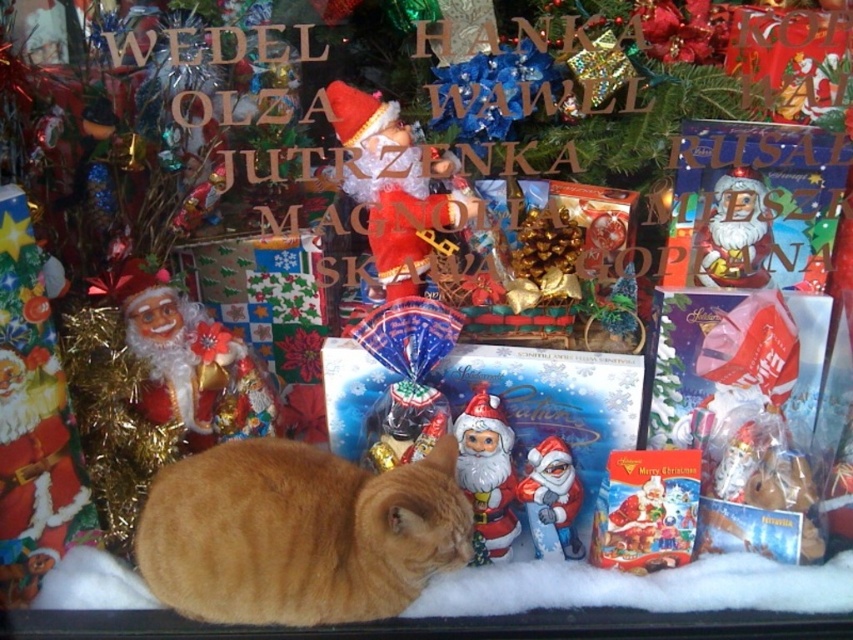
Can you confirm if orange fur cat at lower center is shorter than matte cardboard box at center?

No, orange fur cat at lower center is not shorter than matte cardboard box at center.

Does orange fur cat at lower center have a smaller size compared to matte cardboard box at center?

Incorrect, orange fur cat at lower center is not smaller in size than matte cardboard box at center.

Is point (221, 560) positioned after point (625, 452)?

No, it is in front of (625, 452).

Find the location of a particular element. orange fur cat at lower center is located at coordinates (299, 532).

Is point (136, 616) less distant than point (650, 500)?

Yes.

Measure the distance between black glass at lower center and camera.

black glass at lower center is 91.93 centimeters away from camera.

The image size is (853, 640). Find the location of `black glass at lower center`. black glass at lower center is located at coordinates (434, 625).

Is the position of orange fur cat at lower center more distant than that of black glass at lower center?

No, orange fur cat at lower center is in front of black glass at lower center.

Is point (332, 564) closer to viewer compared to point (550, 612)?

Yes, point (332, 564) is in front of point (550, 612).

Does point (361, 611) lie behind point (808, 632)?

No.

Locate an element on the screen. orange fur cat at lower center is located at coordinates (299, 532).